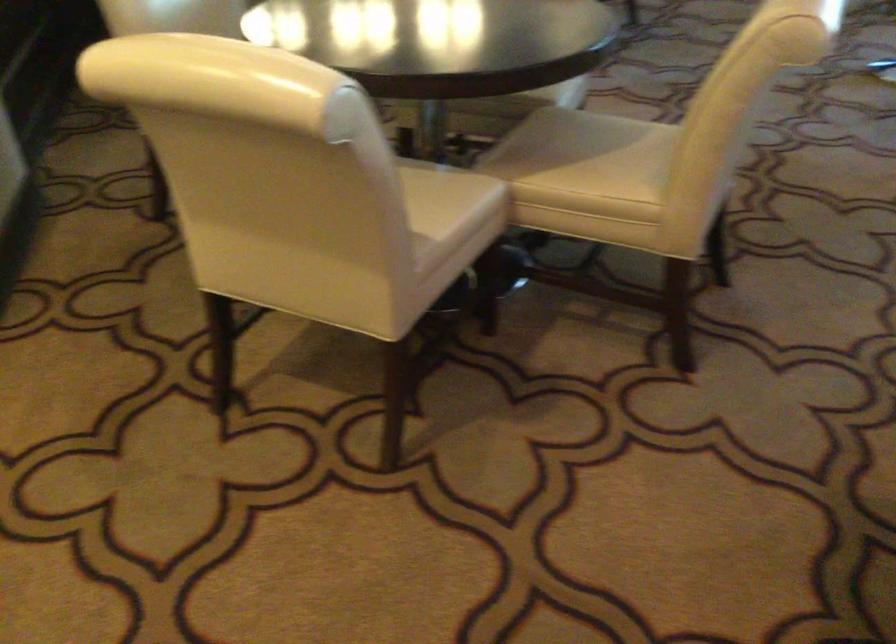
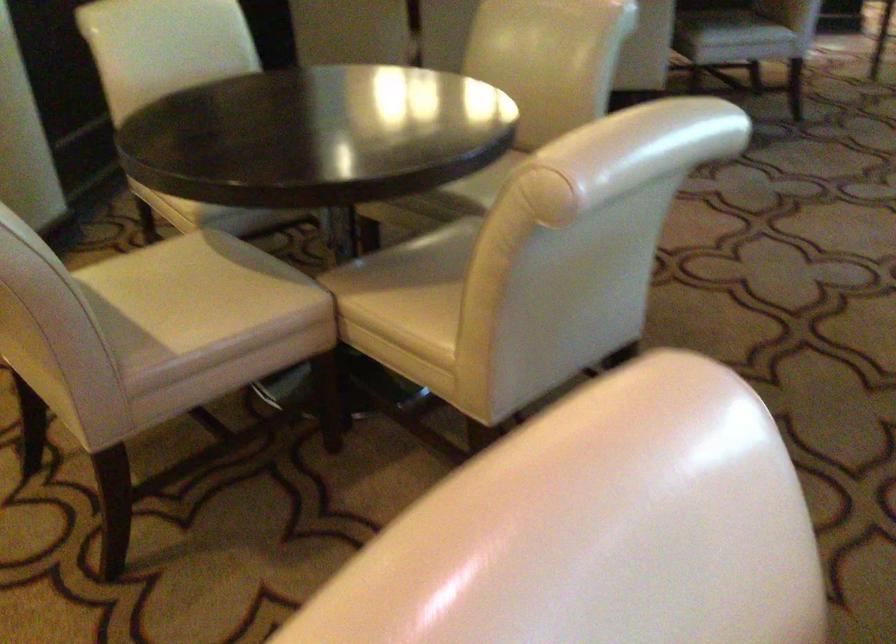
Which direction would the cameraman need to move to produce the second image?

The cameraman walked toward right, forward.